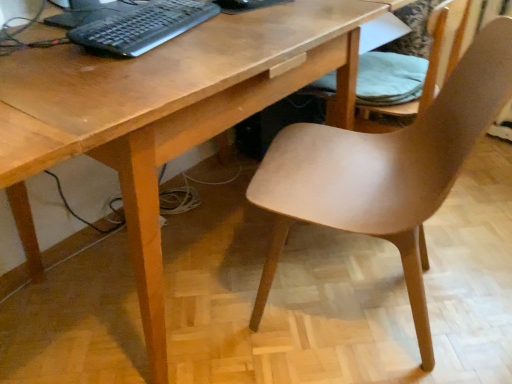
This screenshot has width=512, height=384. What are the coordinates of `vacant space in front of black plastic keyboard at upper left` in the screenshot? It's located at (131, 66).